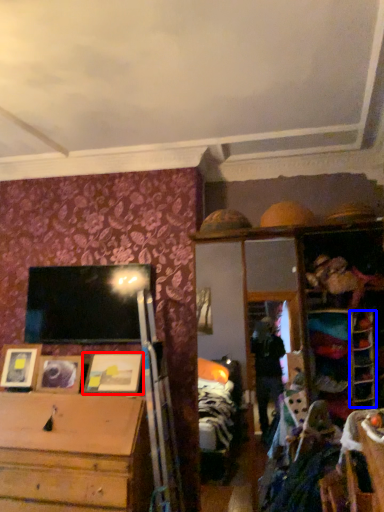
Question: Among these objects, which one is farthest to the camera, picture frame (highlighted by a red box) or shelf (highlighted by a blue box)?

Choices:
 (A) picture frame
 (B) shelf

Answer: (A)